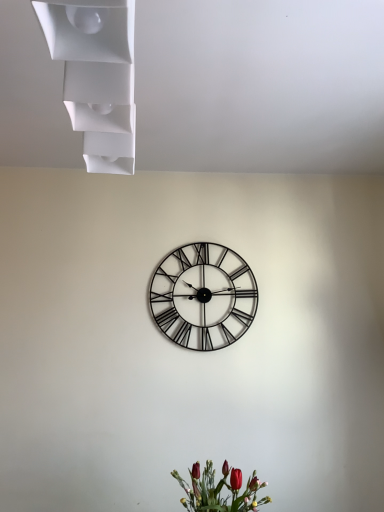
Identify the location of matte red flowers at lower center. (220, 490).

Where is `white matte shelf at upper left`? This screenshot has width=384, height=512. white matte shelf at upper left is located at coordinates (96, 76).

Considering the relative sizes of matte red flowers at lower center and metallic black clock at center in the image provided, is matte red flowers at lower center smaller than metallic black clock at center?

No, matte red flowers at lower center is not smaller than metallic black clock at center.

Based on the photo, who is taller, matte red flowers at lower center or metallic black clock at center?

metallic black clock at center is taller.

Which object is wider, matte red flowers at lower center or metallic black clock at center?

matte red flowers at lower center.

Is matte red flowers at lower center oriented towards metallic black clock at center?

No, matte red flowers at lower center is not turned towards metallic black clock at center.

From a real-world perspective, between metallic black clock at center and matte red flowers at lower center, who is vertically higher?

metallic black clock at center.

In the scene shown: Considering the sizes of metallic black clock at center and matte red flowers at lower center in the image, is metallic black clock at center taller or shorter than matte red flowers at lower center?

Considering their sizes, metallic black clock at center has more height than matte red flowers at lower center.

Is metallic black clock at center to the left of matte red flowers at lower center from the viewer's perspective?

Yes, metallic black clock at center is to the left of matte red flowers at lower center.

Is white matte shelf at upper left taller or shorter than metallic black clock at center?

white matte shelf at upper left is shorter than metallic black clock at center.

Is white matte shelf at upper left inside or outside of metallic black clock at center?

white matte shelf at upper left is not inside metallic black clock at center, it's outside.

What's the angular difference between white matte shelf at upper left and metallic black clock at center's facing directions?

There is a 86.8-degree angle between the facing directions of white matte shelf at upper left and metallic black clock at center.

Is the position of white matte shelf at upper left more distant than that of metallic black clock at center?

No, white matte shelf at upper left is closer to the viewer.

Is the depth of metallic black clock at center less than that of white matte shelf at upper left?

No, metallic black clock at center is further to the viewer.

Is metallic black clock at center looking in the opposite direction of white matte shelf at upper left?

metallic black clock at center is not turned away from white matte shelf at upper left.

How different are the orientations of metallic black clock at center and white matte shelf at upper left in degrees?

The angular difference between metallic black clock at center and white matte shelf at upper left is 86.8 degrees.

From a real-world perspective, is metallic black clock at center positioned above or below white matte shelf at upper left?

Clearly, from a real-world perspective, metallic black clock at center is below white matte shelf at upper left.

Is white matte shelf at upper left looking in the opposite direction of matte red flowers at lower center?

No, white matte shelf at upper left is not facing away from matte red flowers at lower center.

Which of these two, white matte shelf at upper left or matte red flowers at lower center, is bigger?

With larger size is matte red flowers at lower center.

Can you confirm if white matte shelf at upper left is positioned to the right of matte red flowers at lower center?

No.

Where is `floral arrangement on the right of the white matte shelf at upper left`? This screenshot has height=512, width=384. floral arrangement on the right of the white matte shelf at upper left is located at coordinates (220, 490).

Which of these two, matte red flowers at lower center or white matte shelf at upper left, is bigger?

With larger size is matte red flowers at lower center.

From a real-world perspective, is matte red flowers at lower center under white matte shelf at upper left?

Yes.

Is white matte shelf at upper left inside matte red flowers at lower center?

No, white matte shelf at upper left is located outside of matte red flowers at lower center.

Which is closer, [224,471] or [68,5]?

The point [68,5] is closer to the camera.

Locate an element on the screen. Image resolution: width=384 pixels, height=512 pixels. wall clock on the left side of matte red flowers at lower center is located at coordinates (203, 296).

You are a GUI agent. You are given a task and a screenshot of the screen. Output one action in this format:
    pyautogui.click(x=<x>, y=<y>)
    Task: Click on the wall clock located above the matte red flowers at lower center (from a real-world perspective)
    This screenshot has width=384, height=512.
    Given the screenshot: What is the action you would take?
    pyautogui.click(x=203, y=296)

Estimate the real-world distances between objects in this image. Which object is further from matte red flowers at lower center, white matte shelf at upper left or metallic black clock at center?

white matte shelf at upper left.

Considering their positions, is matte red flowers at lower center positioned further to metallic black clock at center than white matte shelf at upper left?

Based on the image, white matte shelf at upper left appears to be further to metallic black clock at center.

Considering their positions, is white matte shelf at upper left positioned further to metallic black clock at center than matte red flowers at lower center?

white matte shelf at upper left is positioned further to the anchor metallic black clock at center.

From the image, which object appears to be farther from white matte shelf at upper left, metallic black clock at center or matte red flowers at lower center?

Among the two, metallic black clock at center is located further to white matte shelf at upper left.

From the image, which object appears to be farther from matte red flowers at lower center, metallic black clock at center or white matte shelf at upper left?

The object further to matte red flowers at lower center is white matte shelf at upper left.

From the image, which object appears to be farther from white matte shelf at upper left, matte red flowers at lower center or metallic black clock at center?

metallic black clock at center lies further to white matte shelf at upper left than the other object.

Identify the location of floral arrangement between white matte shelf at upper left and metallic black clock at center along the z-axis. This screenshot has height=512, width=384. (220, 490).